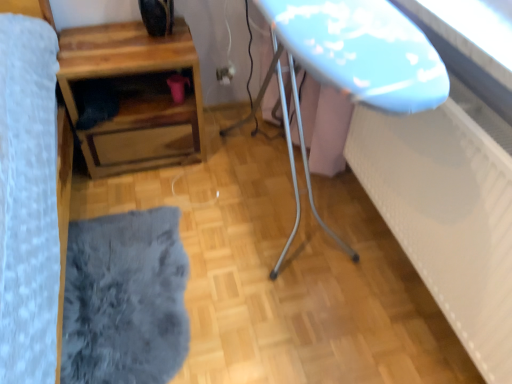
At what (x,y) coordinates should I click in order to perform the action: click on free spot above wooden table at lower left (from a real-world perspective). Please return your answer as a coordinate pair (x, y). The image size is (512, 384). Looking at the image, I should click on (116, 49).